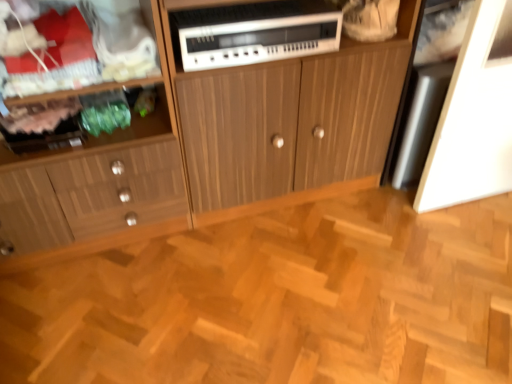
Question: Does natural wood parquet floor at center appear on the left side of wooden cabinet at left, which appears as the first cabinetry when viewed from the left?

Choices:
 (A) no
 (B) yes

Answer: (A)

Question: Considering the relative positions of natural wood parquet floor at center and wooden cabinet at left, which appears as the first cabinetry when viewed from the left, in the image provided, is natural wood parquet floor at center to the right of wooden cabinet at left, which appears as the first cabinetry when viewed from the left, from the viewer's perspective?

Choices:
 (A) no
 (B) yes

Answer: (B)

Question: Considering the relative sizes of natural wood parquet floor at center and wooden cabinet at left, which appears as the first cabinetry when viewed from the left, in the image provided, is natural wood parquet floor at center wider than wooden cabinet at left, which appears as the first cabinetry when viewed from the left,?

Choices:
 (A) yes
 (B) no

Answer: (A)

Question: Is natural wood parquet floor at center positioned in front of wooden cabinet at left, which appears as the first cabinetry when viewed from the left?

Choices:
 (A) yes
 (B) no

Answer: (A)

Question: Can you confirm if natural wood parquet floor at center is taller than wooden cabinet at left, placed as the second cabinetry when sorted from right to left?

Choices:
 (A) no
 (B) yes

Answer: (A)

Question: Can you confirm if natural wood parquet floor at center is shorter than wooden cabinet at left, placed as the second cabinetry when sorted from right to left?

Choices:
 (A) yes
 (B) no

Answer: (A)

Question: Considering the relative positions of white plastic stereo at center and natural wood parquet floor at center in the image provided, is white plastic stereo at center to the left of natural wood parquet floor at center from the viewer's perspective?

Choices:
 (A) no
 (B) yes

Answer: (B)

Question: Does white plastic stereo at center contain natural wood parquet floor at center?

Choices:
 (A) no
 (B) yes

Answer: (A)

Question: Is white plastic stereo at center oriented away from natural wood parquet floor at center?

Choices:
 (A) yes
 (B) no

Answer: (B)

Question: Can you confirm if white plastic stereo at center is shorter than natural wood parquet floor at center?

Choices:
 (A) no
 (B) yes

Answer: (A)

Question: Considering the relative sizes of white plastic stereo at center and natural wood parquet floor at center in the image provided, is white plastic stereo at center thinner than natural wood parquet floor at center?

Choices:
 (A) yes
 (B) no

Answer: (A)

Question: Is white plastic stereo at center to the right of natural wood parquet floor at center from the viewer's perspective?

Choices:
 (A) yes
 (B) no

Answer: (B)

Question: From a real-world perspective, is natural wood parquet floor at center positioned under wooden cabinet at center, acting as the 1th cabinetry starting from the right, based on gravity?

Choices:
 (A) no
 (B) yes

Answer: (B)